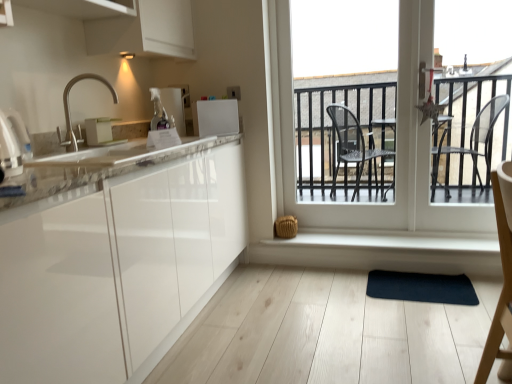
This screenshot has width=512, height=384. What are the coordinates of `vacant space underneath transparent glass door at center (from a real-world perspective)` in the screenshot? It's located at (399, 234).